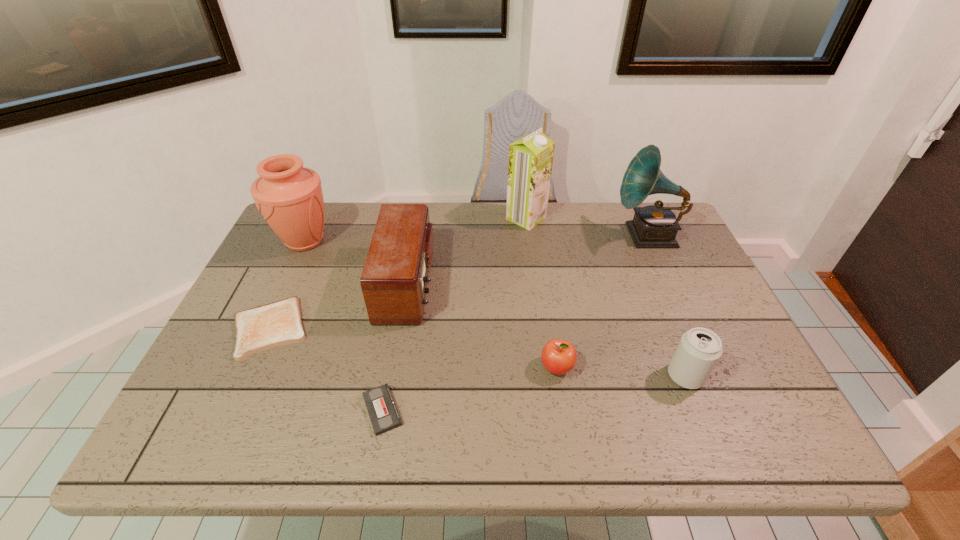
Locate an element on the screen. vacant space located 0.390m from the horn of the phonograph_record is located at coordinates (487, 235).

You are a GUI agent. You are given a task and a screenshot of the screen. Output one action in this format:
    pyautogui.click(x=<x>, y=<y>)
    Task: Click on the blank space located 0.350m from the horn of the phonograph_record
    Image resolution: width=960 pixels, height=540 pixels.
    Given the screenshot: What is the action you would take?
    pyautogui.click(x=499, y=235)

Locate an element on the screen. The width and height of the screenshot is (960, 540). vacant space located 0.220m on the right of the vase is located at coordinates coord(408,241).

Where is `free point located on the front-facing side of the fifth shortest object`? The width and height of the screenshot is (960, 540). free point located on the front-facing side of the fifth shortest object is located at coordinates (572, 284).

I want to click on vacant space situated 0.080m on the right of the can, so click(x=739, y=376).

Where is `vacant space situated on the left of the third shortest object`? This screenshot has height=540, width=960. vacant space situated on the left of the third shortest object is located at coordinates (492, 367).

You are a GUI agent. You are given a task and a screenshot of the screen. Output one action in this format:
    pyautogui.click(x=<x>, y=<y>)
    Task: Click on the free space located on the back of the toast
    
    Given the screenshot: What is the action you would take?
    pyautogui.click(x=292, y=279)

Where is `vacant area located on the left of the videotape`? Image resolution: width=960 pixels, height=540 pixels. vacant area located on the left of the videotape is located at coordinates (198, 410).

I want to click on soya milk positioned at the far edge, so click(x=531, y=157).

Image resolution: width=960 pixels, height=540 pixels. I want to click on phonograph_record located at the far edge, so 654,226.